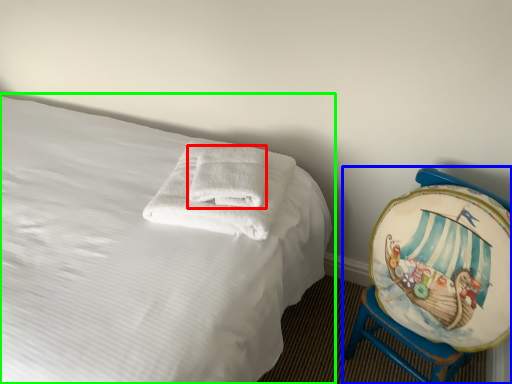
Question: Based on their relative distances, which object is farther from bath towel (highlighted by a red box)? Choose from furniture (highlighted by a blue box) and bed (highlighted by a green box).

Choices:
 (A) furniture
 (B) bed

Answer: (A)